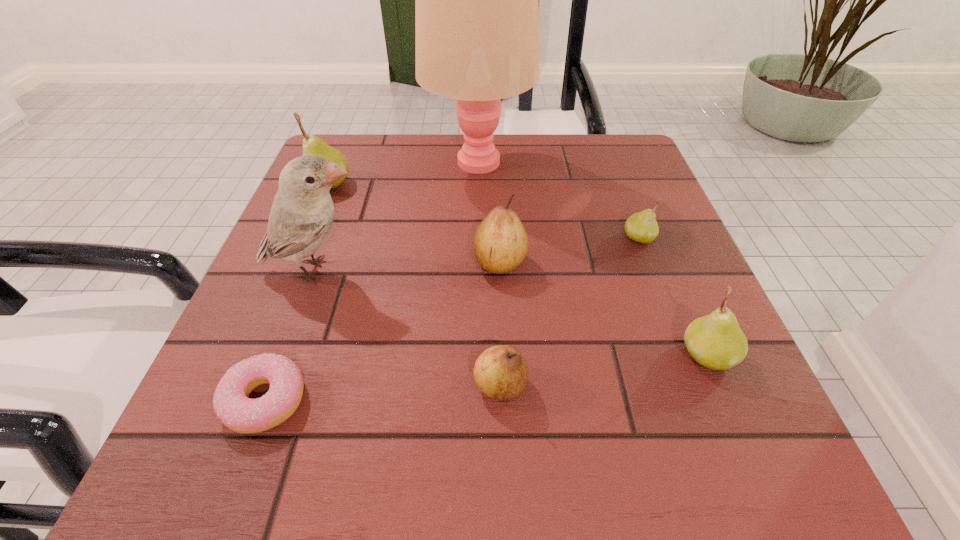
This screenshot has height=540, width=960. I want to click on vacant space in between the second farthest green pear and the pink lampshade, so click(558, 200).

At what (x,y) coordinates should I click in order to perform the action: click on vacant space that's between the smallest green pear and the bigger brown pear. Please return your answer as a coordinate pair (x, y). The height and width of the screenshot is (540, 960). Looking at the image, I should click on (569, 250).

The height and width of the screenshot is (540, 960). I want to click on the second closest object to the second nearest green pear, so click(x=476, y=0).

Locate an element on the screen. This screenshot has height=540, width=960. object that is the sixth closest to the second biggest green pear is located at coordinates (231, 403).

This screenshot has height=540, width=960. In order to click on pear object that ranks as the fourth closest to the smaller brown pear in this screenshot , I will do point(312,145).

Image resolution: width=960 pixels, height=540 pixels. I want to click on pear identified as the second closest to the white bird, so click(x=500, y=243).

Find the location of a particular element. The width and height of the screenshot is (960, 540). green pear that is the second nearest to the tallest object is located at coordinates (642, 227).

At what (x,y) coordinates should I click in order to perform the action: click on the closest green pear to the nearest green pear. Please return your answer as a coordinate pair (x, y). This screenshot has height=540, width=960. Looking at the image, I should click on (642, 227).

This screenshot has width=960, height=540. I want to click on blank space that satisfies the following two spatial constraints: 1. at the face of the nearer brown pear; 2. on the right side of the white bird, so click(276, 385).

Find the location of a particular element. vacant space that satisfies the following two spatial constraints: 1. on the back side of the farther brown pear; 2. on the right side of the nearer brown pear is located at coordinates [x=496, y=262].